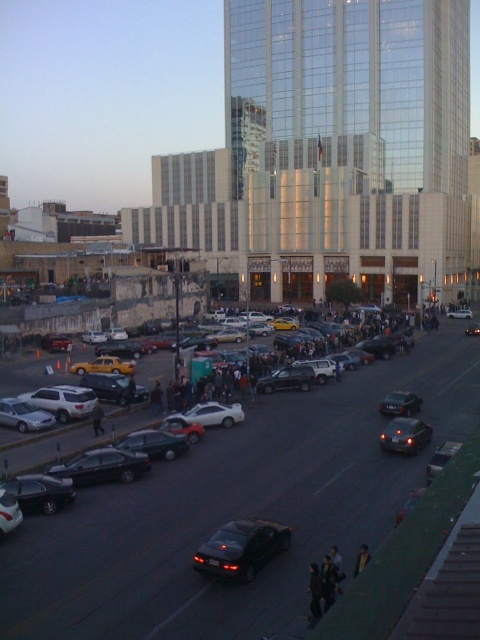
In order to click on black matte sedan at lower center in this screenshot , I will do `click(240, 548)`.

The height and width of the screenshot is (640, 480). Describe the element at coordinates (240, 548) in the screenshot. I see `black matte sedan at lower center` at that location.

Does point (242, 545) lie in front of point (456, 316)?

Yes, point (242, 545) is in front of point (456, 316).

You are a GUI agent. You are given a task and a screenshot of the screen. Output one action in this format:
    pyautogui.click(x=<x>, y=<y>)
    Task: Click on the black matte sedan at lower center
    
    Given the screenshot: What is the action you would take?
    pos(240,548)

Is black matte sedan at lower center bigger than shiny silver sedan at center?

No.

From the picture: Does black matte sedan at lower center appear on the left side of shiny silver sedan at center?

Correct, you'll find black matte sedan at lower center to the left of shiny silver sedan at center.

This screenshot has height=640, width=480. What do you see at coordinates (240, 548) in the screenshot?
I see `black matte sedan at lower center` at bounding box center [240, 548].

The width and height of the screenshot is (480, 640). Find the location of `black matte sedan at lower center`. black matte sedan at lower center is located at coordinates (240, 548).

Looking at this image, is satin silver suv at center-left to the right of satin black sedan at center from the viewer's perspective?

No, satin silver suv at center-left is not to the right of satin black sedan at center.

Between satin silver suv at center-left and satin black sedan at center, which one is positioned higher?

satin silver suv at center-left is higher up.

Locate an element on the screen. The width and height of the screenshot is (480, 640). satin silver suv at center-left is located at coordinates coord(62,401).